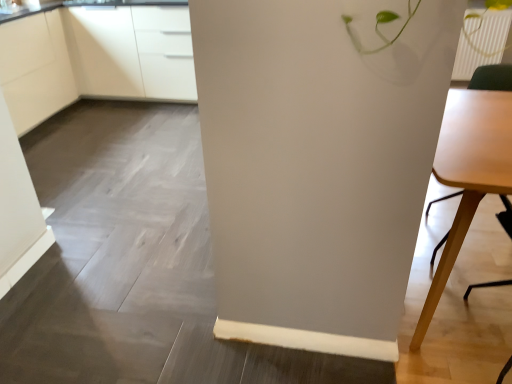
Question: Is white matte cabinet at upper left, marked as the second cabinetry in a right-to-left arrangement, turned away from white glossy cabinets at upper left, which is the first cabinetry in right-to-left order?

Choices:
 (A) no
 (B) yes

Answer: (A)

Question: Can you confirm if white matte cabinet at upper left, marked as the second cabinetry in a right-to-left arrangement, is smaller than white glossy cabinets at upper left, which is the first cabinetry in right-to-left order?

Choices:
 (A) yes
 (B) no

Answer: (A)

Question: Could you tell me if white matte cabinet at upper left, marked as the second cabinetry in a right-to-left arrangement, is facing white glossy cabinets at upper left, which is the 2th cabinetry in left-to-right order?

Choices:
 (A) no
 (B) yes

Answer: (A)

Question: From the image's perspective, is white matte cabinet at upper left, marked as the second cabinetry in a right-to-left arrangement, located above white glossy cabinets at upper left, which is the first cabinetry in right-to-left order?

Choices:
 (A) no
 (B) yes

Answer: (A)

Question: Considering the relative sizes of white matte cabinet at upper left, marked as the 1th cabinetry in a left-to-right arrangement, and white glossy cabinets at upper left, which is the first cabinetry in right-to-left order, in the image provided, is white matte cabinet at upper left, marked as the 1th cabinetry in a left-to-right arrangement, shorter than white glossy cabinets at upper left, which is the first cabinetry in right-to-left order,?

Choices:
 (A) yes
 (B) no

Answer: (B)

Question: Is white matte cabinet at upper left, marked as the 1th cabinetry in a left-to-right arrangement, not inside white glossy cabinets at upper left, which is the first cabinetry in right-to-left order?

Choices:
 (A) yes
 (B) no

Answer: (A)

Question: Does light wood table at right have a lesser height compared to white matte cabinet at upper left, marked as the second cabinetry in a right-to-left arrangement?

Choices:
 (A) yes
 (B) no

Answer: (A)

Question: Is light wood table at right surrounding white matte cabinet at upper left, marked as the second cabinetry in a right-to-left arrangement?

Choices:
 (A) yes
 (B) no

Answer: (B)

Question: Is light wood table at right at the left side of white matte cabinet at upper left, marked as the second cabinetry in a right-to-left arrangement?

Choices:
 (A) no
 (B) yes

Answer: (A)

Question: From the image's perspective, is light wood table at right located above white matte cabinet at upper left, marked as the 1th cabinetry in a left-to-right arrangement?

Choices:
 (A) yes
 (B) no

Answer: (B)

Question: From a real-world perspective, is light wood table at right physically above white matte cabinet at upper left, marked as the second cabinetry in a right-to-left arrangement?

Choices:
 (A) no
 (B) yes

Answer: (A)

Question: Is light wood table at right outside white matte cabinet at upper left, marked as the 1th cabinetry in a left-to-right arrangement?

Choices:
 (A) yes
 (B) no

Answer: (A)

Question: Does white glossy cabinets at upper left, which is the first cabinetry in right-to-left order, have a greater height compared to light wood table at right?

Choices:
 (A) no
 (B) yes

Answer: (B)